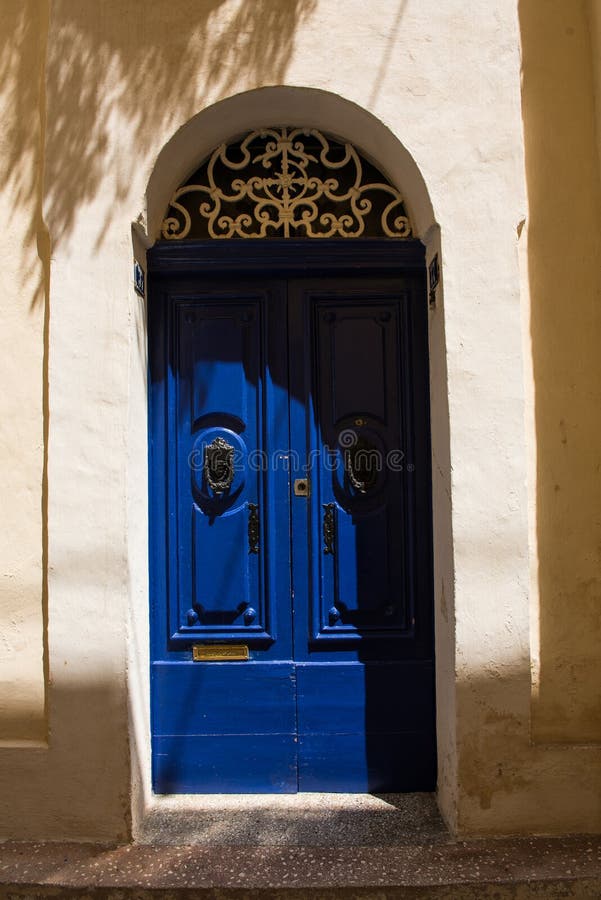
I want to click on door, so click(254, 576), click(321, 594).